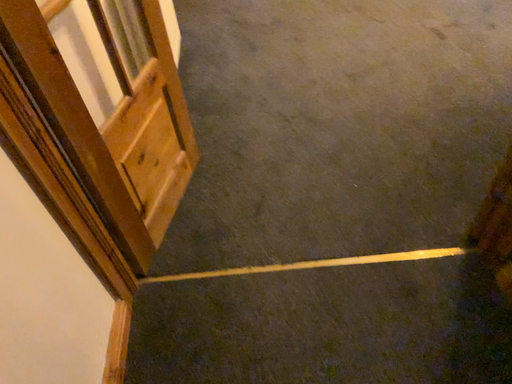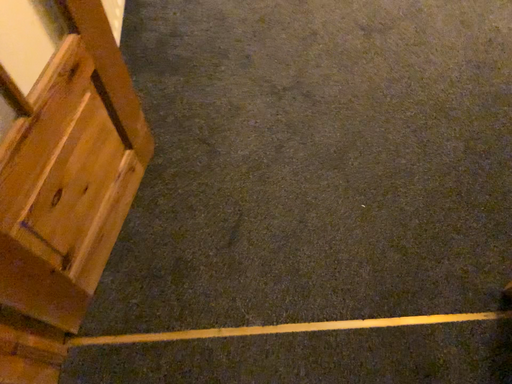
Question: How did the camera likely rotate when shooting the video?

Choices:
 (A) rotated downward
 (B) rotated upward

Answer: (A)